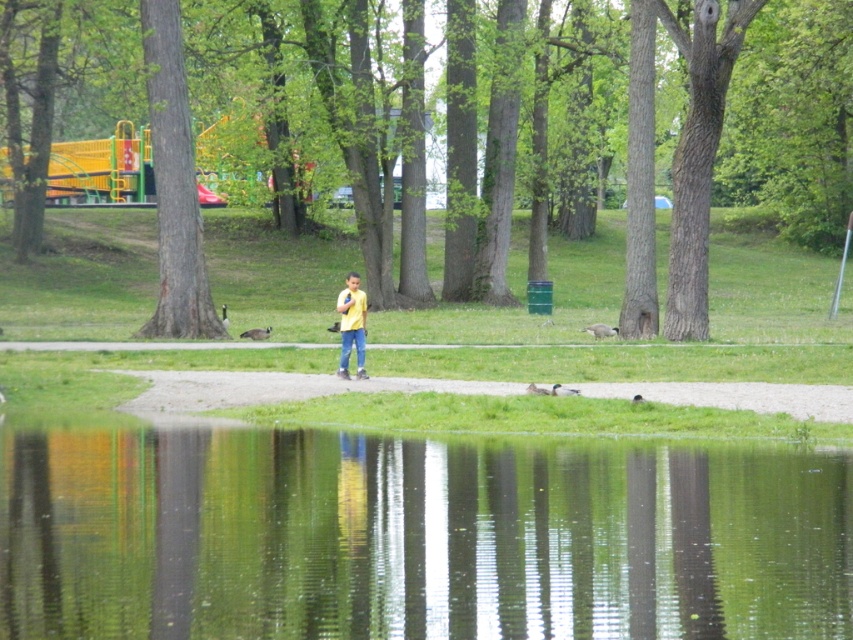
Question: Does brown rough tree at left appear over yellow matte shirt at center?

Choices:
 (A) no
 (B) yes

Answer: (B)

Question: Can you confirm if brown textured tree at center is wider than brown rough tree at left?

Choices:
 (A) no
 (B) yes

Answer: (B)

Question: Which object appears closest to the camera in this image?

Choices:
 (A) yellow matte shirt at center
 (B) green reflective water at center
 (C) brown rough tree at left

Answer: (B)

Question: Which point appears closest to the camera in this image?

Choices:
 (A) (239, 115)
 (B) (170, 301)
 (C) (341, 324)

Answer: (C)

Question: Which point is farther from the camera taking this photo?

Choices:
 (A) (364, 317)
 (B) (192, 204)

Answer: (B)

Question: Is brown textured tree at center positioned at the back of brown rough tree at left?

Choices:
 (A) no
 (B) yes

Answer: (A)